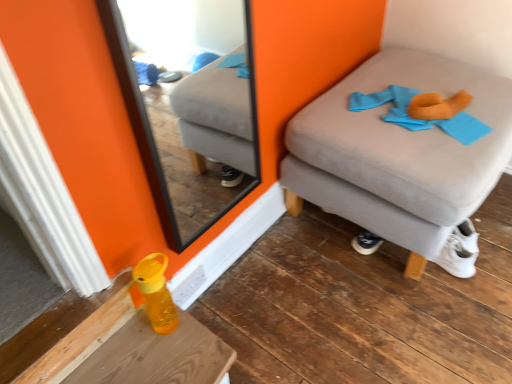
Question: Does wooden table at lower left come in front of suede ottoman at right?

Choices:
 (A) no
 (B) yes

Answer: (B)

Question: From the image's perspective, is wooden table at lower left beneath suede ottoman at right?

Choices:
 (A) no
 (B) yes

Answer: (B)

Question: Considering the relative positions of wooden table at lower left and suede ottoman at right in the image provided, is wooden table at lower left to the left of suede ottoman at right from the viewer's perspective?

Choices:
 (A) no
 (B) yes

Answer: (B)

Question: Is wooden table at lower left beside suede ottoman at right?

Choices:
 (A) no
 (B) yes

Answer: (A)

Question: From a real-world perspective, is wooden table at lower left physically above suede ottoman at right?

Choices:
 (A) no
 (B) yes

Answer: (A)

Question: Can you confirm if wooden table at lower left is positioned to the right of suede ottoman at right?

Choices:
 (A) yes
 (B) no

Answer: (B)

Question: Does translucent yellow bottle at lower left appear on the right side of blue fabric at upper right?

Choices:
 (A) no
 (B) yes

Answer: (A)

Question: From a real-world perspective, is translucent yellow bottle at lower left under blue fabric at upper right?

Choices:
 (A) yes
 (B) no

Answer: (A)

Question: Can you confirm if translucent yellow bottle at lower left is positioned to the left of blue fabric at upper right?

Choices:
 (A) yes
 (B) no

Answer: (A)

Question: Could you tell me if translucent yellow bottle at lower left is turned towards blue fabric at upper right?

Choices:
 (A) yes
 (B) no

Answer: (B)

Question: Does translucent yellow bottle at lower left have a lesser width compared to blue fabric at upper right?

Choices:
 (A) yes
 (B) no

Answer: (A)

Question: From the image's perspective, is translucent yellow bottle at lower left located above blue fabric at upper right?

Choices:
 (A) no
 (B) yes

Answer: (A)

Question: Is wooden table at lower left to the left of blue fabric at upper right from the viewer's perspective?

Choices:
 (A) yes
 (B) no

Answer: (A)